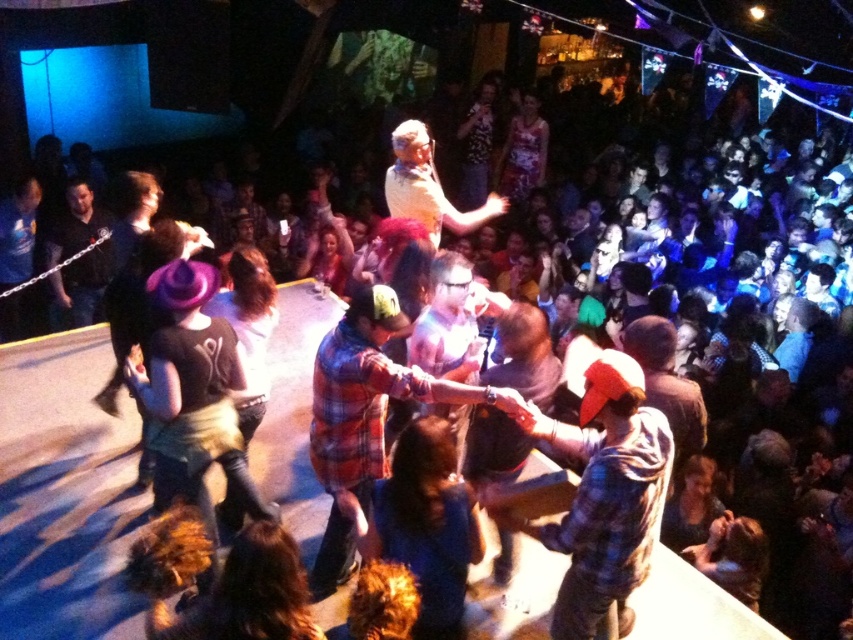
You are at a party and want to take a photo of both the plaid flannel shirt at center and the matte black shirt at left. Which shirt should you focus on first if you want to capture both in the same frame without moving your camera?

You should focus on the plaid flannel shirt at center first because it is positioned to the right of the matte black shirt at left, so adjusting the camera angle to include both would require framing from the leftmost point of the matte black shirt at left to the rightmost point of the plaid flannel shirt at center.

You are a photographer at the party and want to capture both the plaid shirt at center and the matte black shirt at left in a single shot. Based on their positions, which one should you focus on first to ensure both are in frame?

The plaid shirt at center is located below the matte black shirt at left, so you should focus on the matte black shirt at left first to ensure both are in frame.

You are standing at the back of the venue and want to take a photo of the stage. There are two points marked in the image. The first point is at coordinates point (408, 321), and the second point is at coordinates point (62, 214). Which point is closer to you?

Point (62, 214) is further away from you than point (408, 321) because the description states that point (408, 321) is in front of point (62, 214). Since you are at the back, the point in front would be closer.